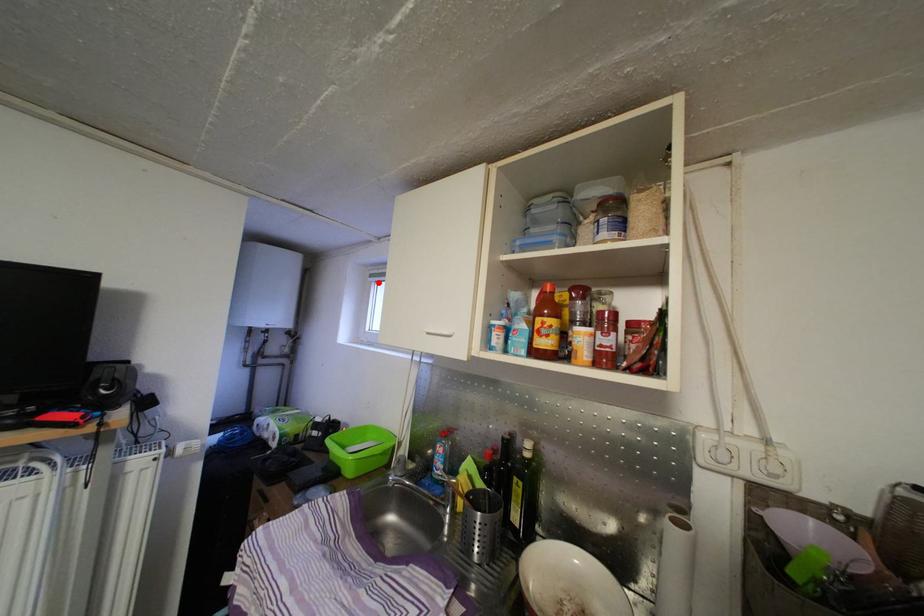
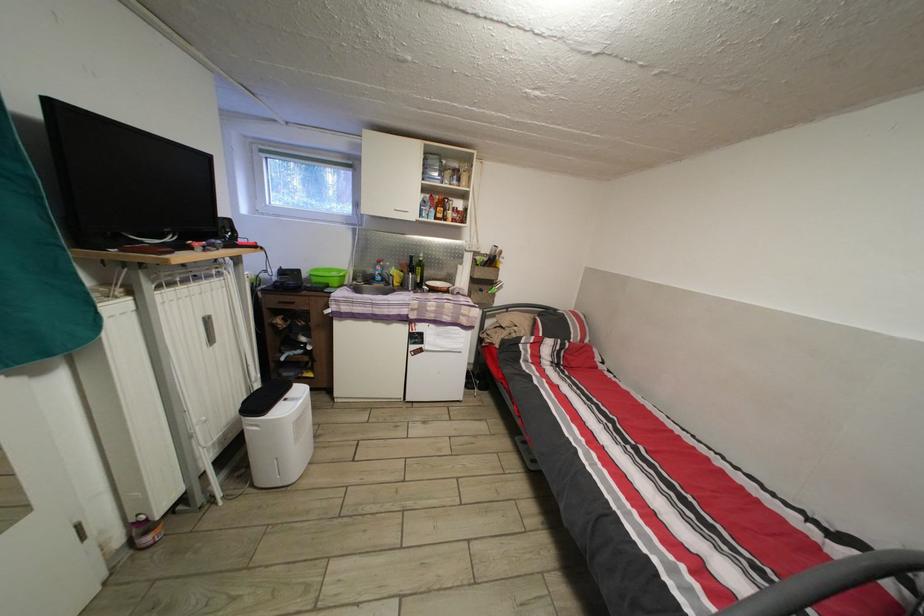
Question: I am providing you with two images of the same scene from different viewpoints. In image1, a red point is highlighted. Considering the same 3D point in image2, which of the following is correct?

Choices:
 (A) It is closer
 (B) It is farther

Answer: (B)